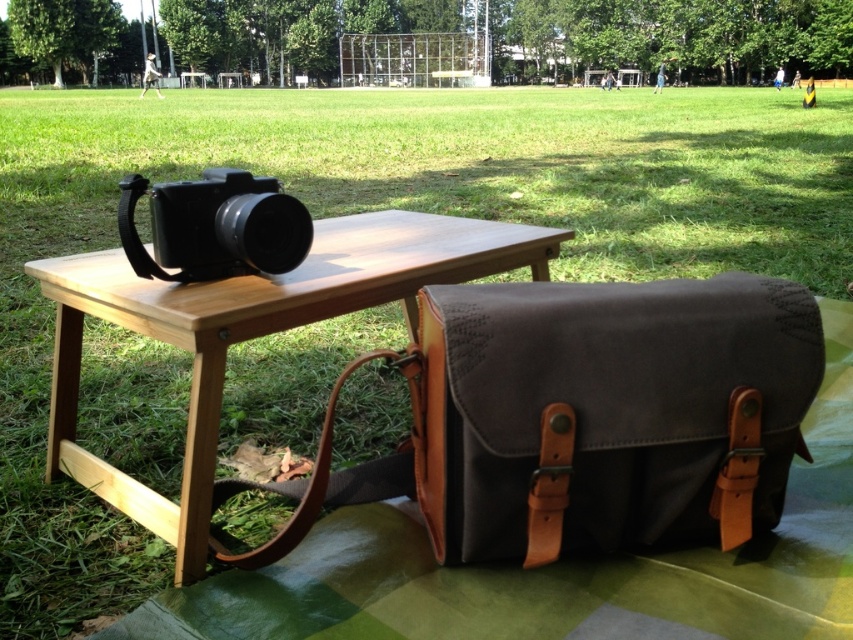
Which is in front, point (434, 380) or point (196, 548)?

Point (434, 380) is more forward.

Which is behind, point (431, 534) or point (233, 324)?

Point (431, 534)

Does point (607, 394) lie in front of point (114, 266)?

Yes, point (607, 394) is closer to viewer.

This screenshot has width=853, height=640. I want to click on dark gray canvas bag at lower right, so click(x=590, y=416).